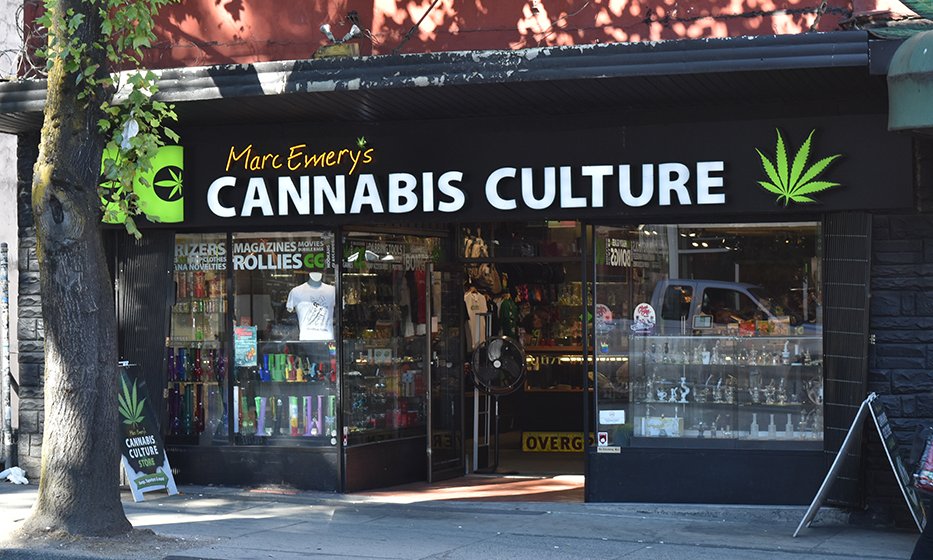
Identify the location of black fan. The height and width of the screenshot is (560, 933). (498, 360).